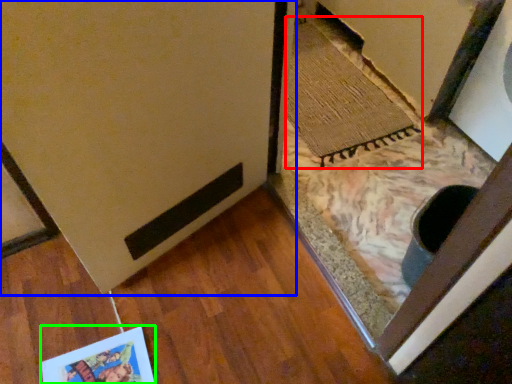
Question: Considering the real-world distances, which object is closest to doormat (highlighted by a red box)? door (highlighted by a blue box) or postcard (highlighted by a green box).

Choices:
 (A) door
 (B) postcard

Answer: (A)